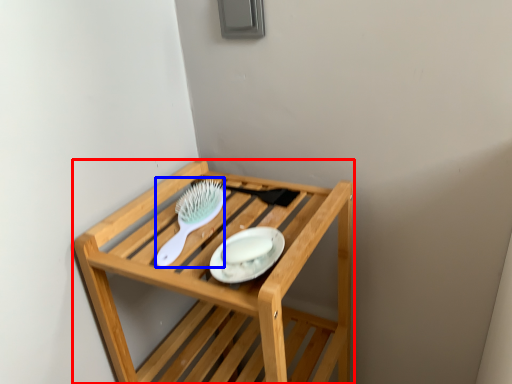
Question: Which point is closer to the camera, furniture (highlighted by a red box) or brush (highlighted by a blue box)?

Choices:
 (A) furniture
 (B) brush

Answer: (A)